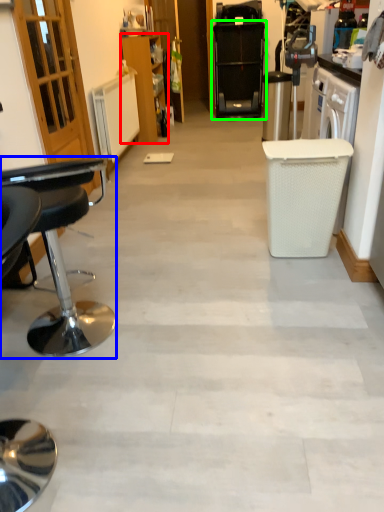
Question: Which object is the closest to the cabinetry (highlighted by a red box)? Choose among these: chair (highlighted by a blue box) or home appliance (highlighted by a green box).

Choices:
 (A) chair
 (B) home appliance

Answer: (B)